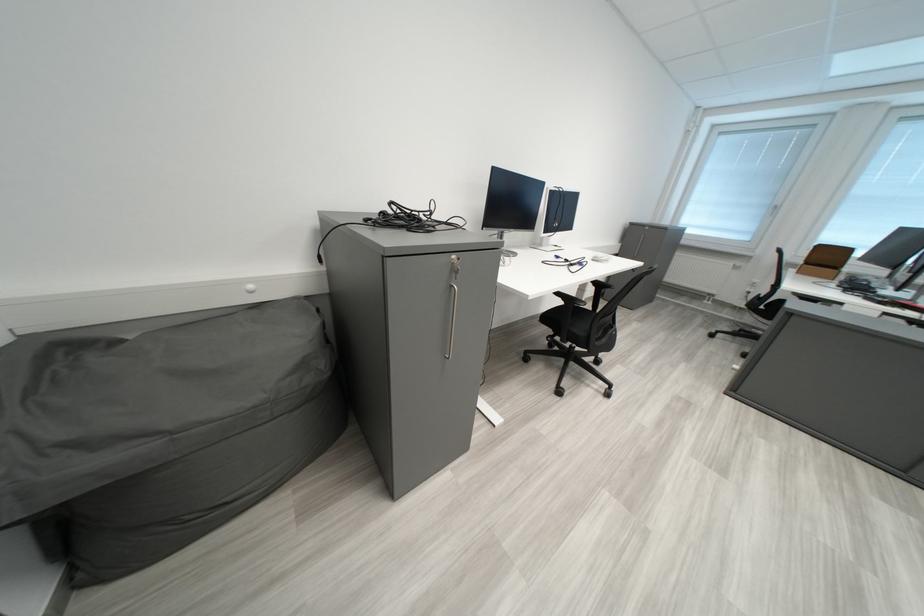
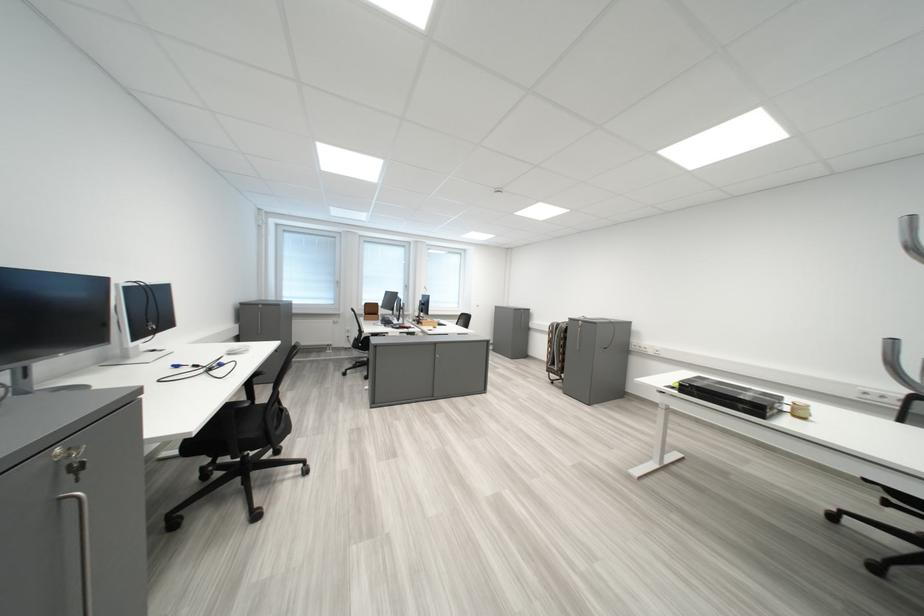
Question: The camera is either moving clockwise (left) or counter-clockwise (right) around the object. The first image is from the beginning of the video and the second image is from the end. Is the camera moving left or right when shooting the video?

Choices:
 (A) Left
 (B) Right

Answer: (A)